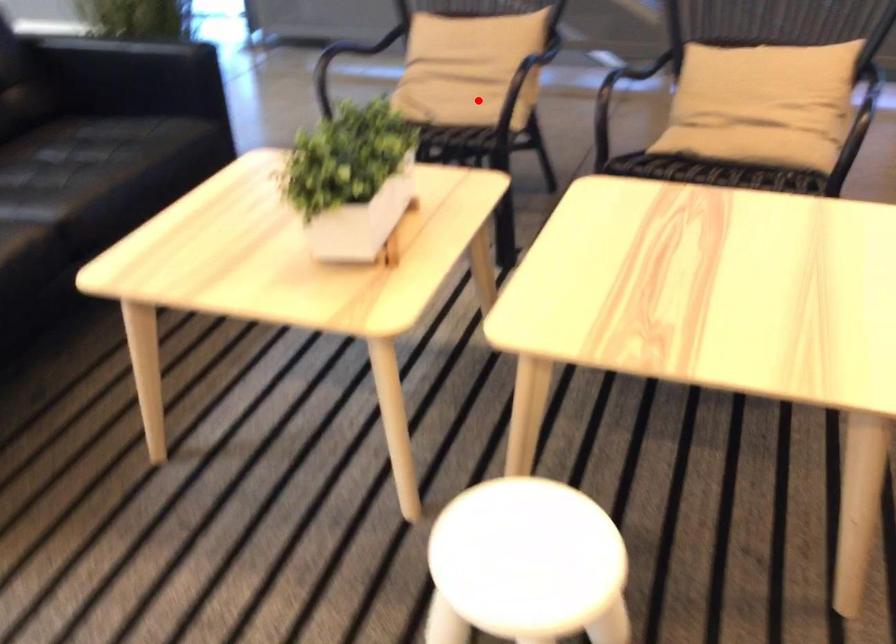
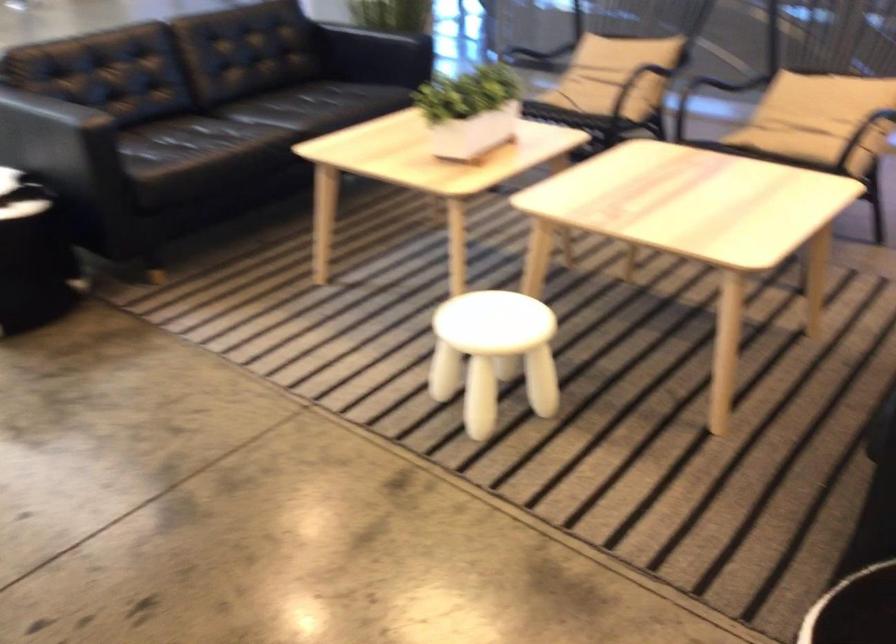
Locate, in the second image, the point that corresponds to the highlighted location in the first image.

(597, 91)